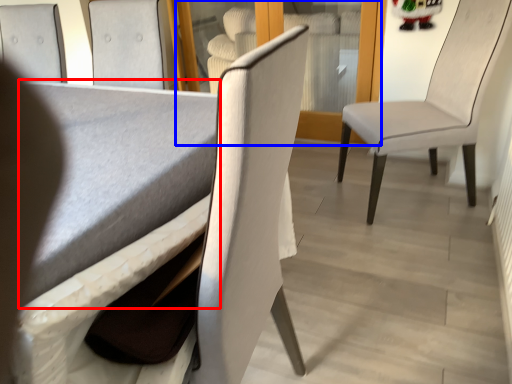
Question: Among these objects, which one is nearest to the camera, table (highlighted by a red box) or glass door (highlighted by a blue box)?

Choices:
 (A) table
 (B) glass door

Answer: (A)